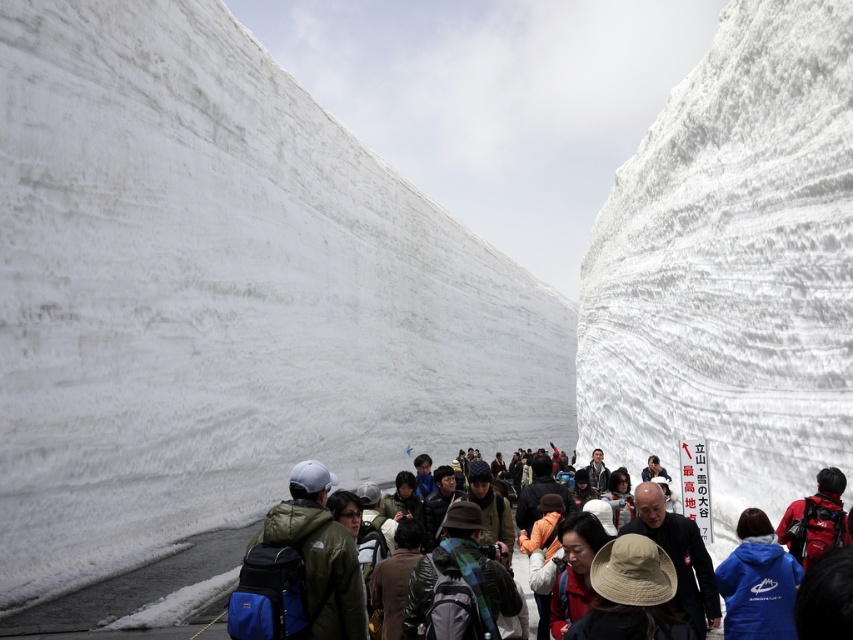
Question: Which object appears farthest from the camera in this image?

Choices:
 (A) blue fleece jacket at center
 (B) red fabric hat at center
 (C) beige straw hat at center

Answer: (B)

Question: Which object is closer to the camera taking this photo?

Choices:
 (A) blue fleece jacket at center
 (B) white fluffy snow at center
 (C) beige straw hat at center

Answer: (C)

Question: Does white fluffy snow at center appear on the left side of blue fleece jacket at center?

Choices:
 (A) no
 (B) yes

Answer: (B)

Question: Can you confirm if blue fleece jacket at center is wider than red fabric hat at center?

Choices:
 (A) no
 (B) yes

Answer: (B)

Question: Which is nearer to the beige straw hat at center?

Choices:
 (A) white fluffy snow at center
 (B) blue fleece jacket at center
 (C) plaid fabric hat at center

Answer: (C)

Question: Is white fluffy snow at center below blue fleece jacket at center?

Choices:
 (A) no
 (B) yes

Answer: (A)